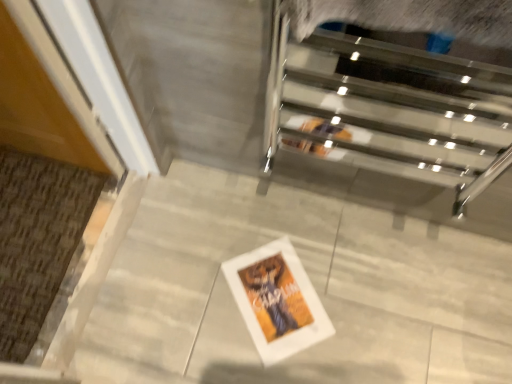
Locate an element on the screen. The width and height of the screenshot is (512, 384). vacant region under white matte picture frame at center (from a real-world perspective) is located at coordinates (272, 299).